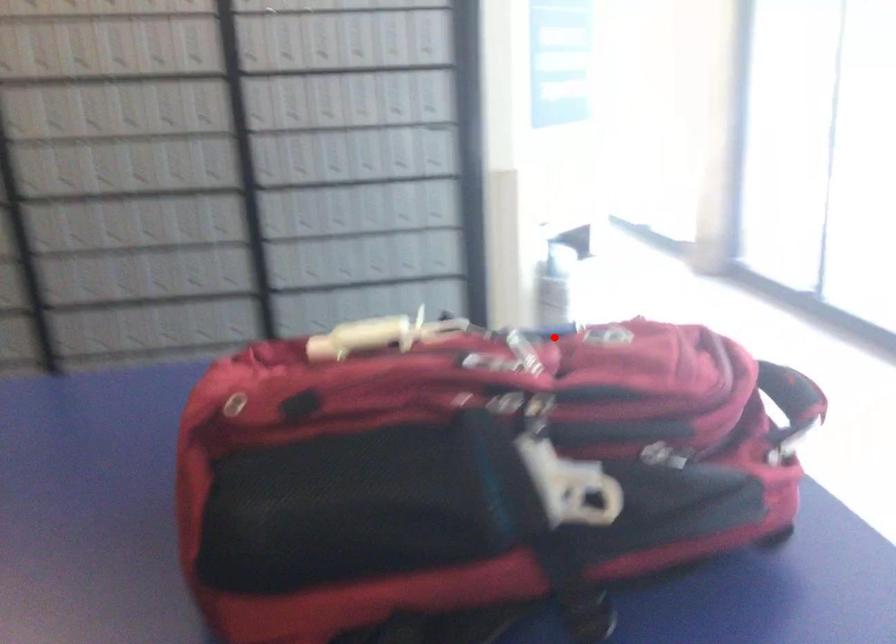
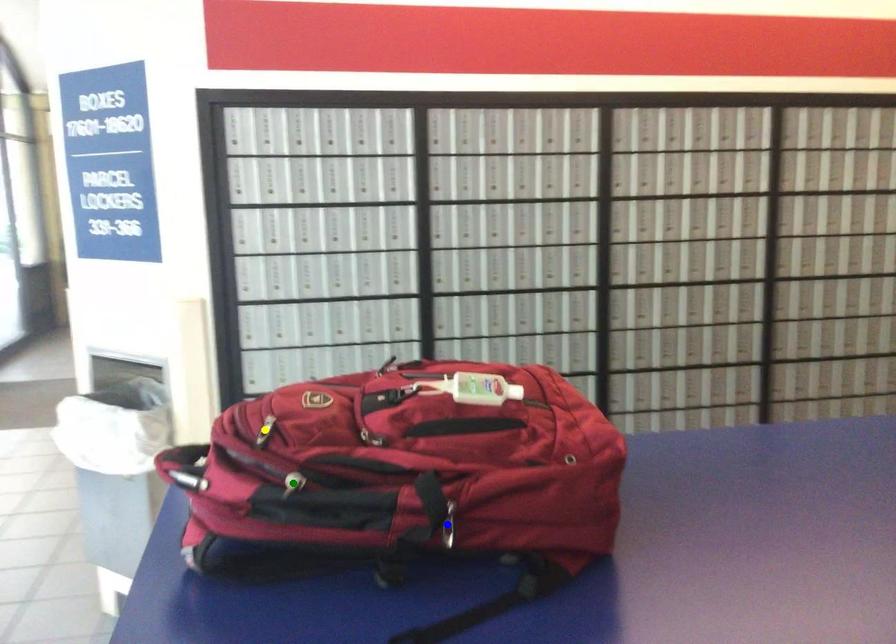
Question: I am providing you with two images of the same scene from different viewpoints. A red point is marked on the first image. You are given multiple points on the second image. Which point in image 2 represents the same 3d spot as the red point in image 1?

Choices:
 (A) green point
 (B) blue point
 (C) yellow point

Answer: (A)